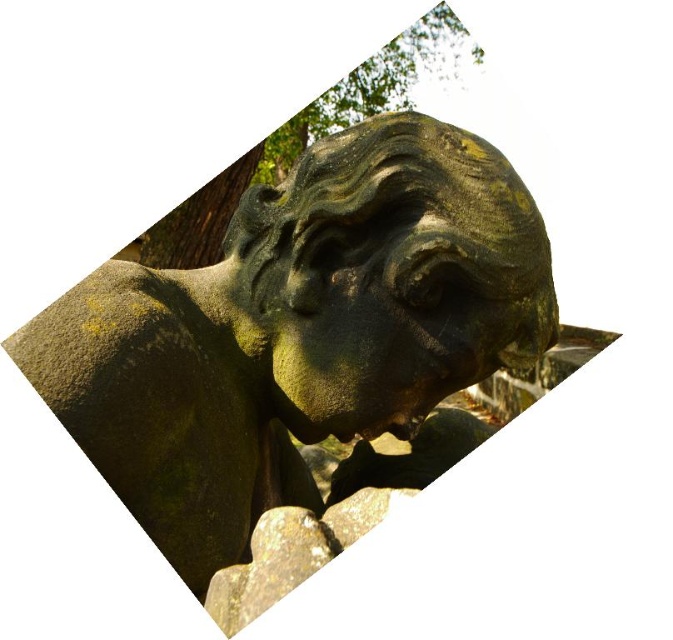
Question: Is green stone statue at center wider than green mossy stone head at center?

Choices:
 (A) no
 (B) yes

Answer: (B)

Question: Which point is farther from the camera taking this photo?

Choices:
 (A) (466, 205)
 (B) (336, 300)
 (C) (448, 40)

Answer: (C)

Question: In this image, where is green stone statue at center located relative to green mossy tree at upper center?

Choices:
 (A) above
 (B) below

Answer: (B)

Question: Can you confirm if green stone statue at center is positioned below green mossy tree at upper center?

Choices:
 (A) yes
 (B) no

Answer: (A)

Question: Which point is farther from the camera taking this photo?

Choices:
 (A) (404, 376)
 (B) (164, 225)
 (C) (328, 216)

Answer: (B)

Question: Which point appears closest to the camera in this image?

Choices:
 (A) (343, 125)
 (B) (258, 316)
 (C) (452, 147)

Answer: (B)